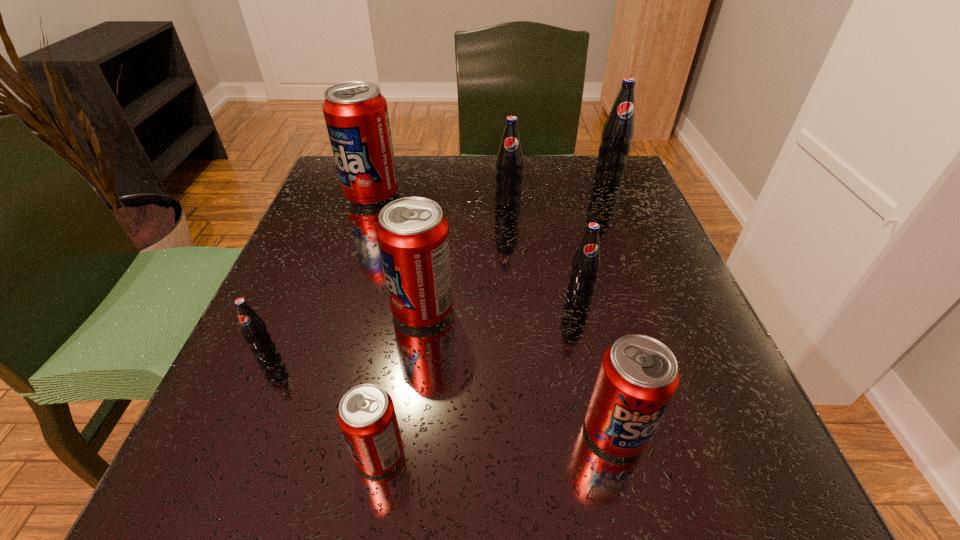
Identify the location of vacant space located on the right of the smallest red soda can. Image resolution: width=960 pixels, height=540 pixels. (592, 454).

Locate an element on the screen. object that is positioned at the far left corner is located at coordinates (356, 114).

Where is `object located in the far right corner section of the desktop`? This screenshot has height=540, width=960. object located in the far right corner section of the desktop is located at coordinates (618, 132).

Where is `object positioned at the near right corner`? The height and width of the screenshot is (540, 960). object positioned at the near right corner is located at coordinates (638, 376).

The width and height of the screenshot is (960, 540). Find the location of `vacant region at the far edge of the desktop`. vacant region at the far edge of the desktop is located at coordinates (424, 156).

Locate an element on the screen. This screenshot has height=540, width=960. free space at the near edge of the desktop is located at coordinates (560, 491).

This screenshot has height=540, width=960. What are the coordinates of `free location at the left edge of the desktop` in the screenshot? It's located at (275, 314).

The width and height of the screenshot is (960, 540). I want to click on vacant region at the right edge, so click(x=741, y=416).

The image size is (960, 540). I want to click on vacant point at the far right corner, so click(x=594, y=157).

Locate an element on the screen. The width and height of the screenshot is (960, 540). vacant area that lies between the leftmost object and the second smallest red soda can is located at coordinates (441, 393).